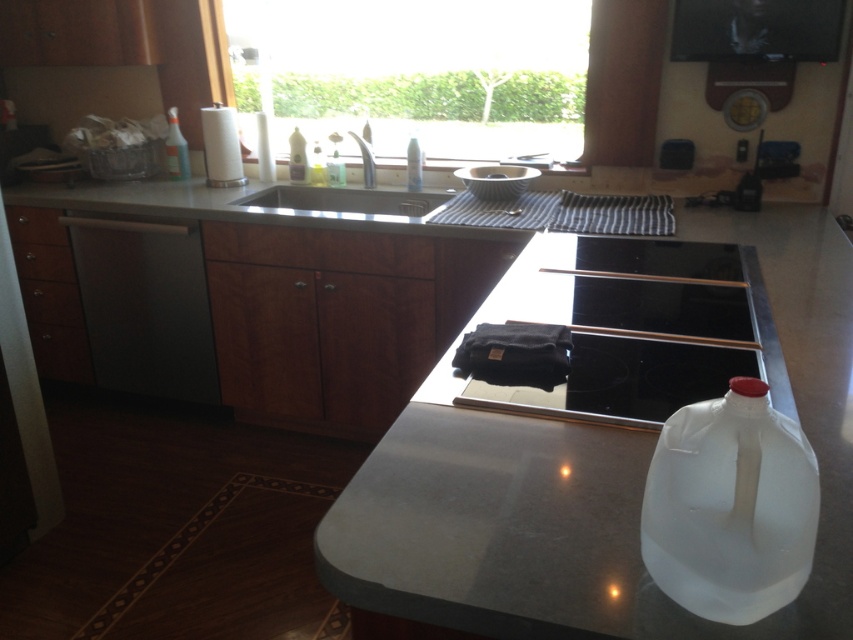
Question: Considering the real-world distances, which object is farthest from the silver metallic faucet at upper center?

Choices:
 (A) stainless steel sink at center
 (B) black glass cooktop at center

Answer: (B)

Question: Can you confirm if black matte stovetop at center is positioned below white ceramic bowl at upper center?

Choices:
 (A) yes
 (B) no

Answer: (A)

Question: Does black matte stovetop at center appear under translucent plastic bottle at sink?

Choices:
 (A) no
 (B) yes

Answer: (B)

Question: Which of the following is the closest to the observer?

Choices:
 (A) black glass cooktop at center
 (B) satin black dishwasher at left
 (C) black matte stovetop at center

Answer: (C)

Question: In this image, where is white ceramic bowl at upper center located relative to clear plastic bottle at center?

Choices:
 (A) above
 (B) below

Answer: (B)

Question: Which of these objects is positioned closest to the silver metallic faucet at upper center?

Choices:
 (A) satin black dishwasher at left
 (B) black matte stovetop at center

Answer: (A)